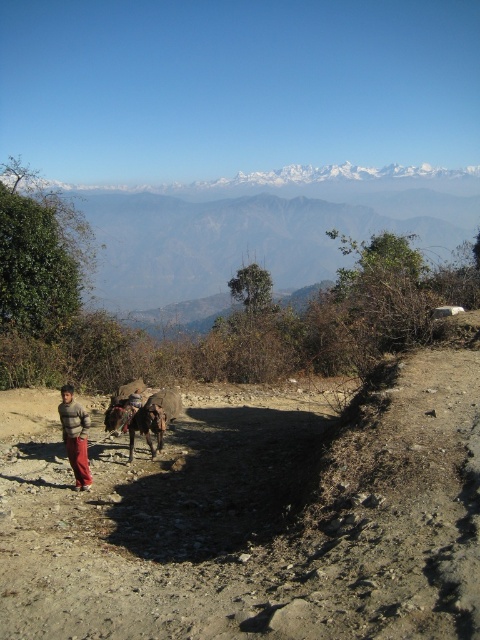
Question: Does knitted sweater at lower left have a greater width compared to brown fuzzy donkey at center?

Choices:
 (A) no
 (B) yes

Answer: (A)

Question: Among these objects, which one is farthest from the camera?

Choices:
 (A) brown dirt track at center
 (B) snowy rocky mountain at upper center
 (C) knitted sweater at lower left

Answer: (B)

Question: Is knitted sweater at lower left wider than brown fuzzy donkey at center?

Choices:
 (A) no
 (B) yes

Answer: (A)

Question: Which object is positioned closest to the brown dirt track at center?

Choices:
 (A) brown fuzzy donkey at center
 (B) snowy rocky mountain at upper center
 (C) knitted sweater at lower left

Answer: (A)

Question: Estimate the real-world distances between objects in this image. Which object is farther from the knitted sweater at lower left?

Choices:
 (A) snowy rocky mountain at upper center
 (B) brown fuzzy donkey at center

Answer: (A)

Question: Can you confirm if snowy rocky mountain at upper center is positioned to the left of brown fuzzy donkey at center?

Choices:
 (A) yes
 (B) no

Answer: (B)